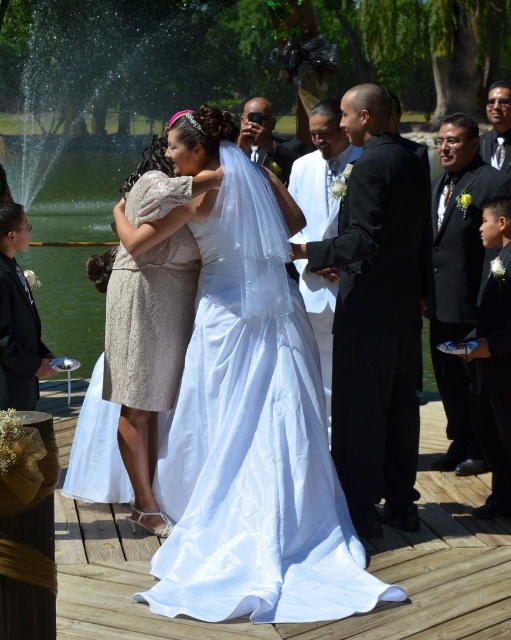
Question: Which object is the farthest from the light beige lace dress at center?

Choices:
 (A) shiny black suit at center
 (B) satin white dress at center
 (C) black satin suit at right

Answer: (C)

Question: Is satin white dress at center wider than black satin suit at center?

Choices:
 (A) yes
 (B) no

Answer: (A)

Question: Among these points, which one is farthest from the camera?

Choices:
 (A) (112, 369)
 (B) (369, 234)

Answer: (A)

Question: Is light beige lace dress at center thinner than shiny black suit at center?

Choices:
 (A) no
 (B) yes

Answer: (A)

Question: Is satin white dress at center smaller than matte black suit at center?

Choices:
 (A) no
 (B) yes

Answer: (A)

Question: Which point is farther to the camera?

Choices:
 (A) coord(299,150)
 (B) coord(413,280)

Answer: (A)